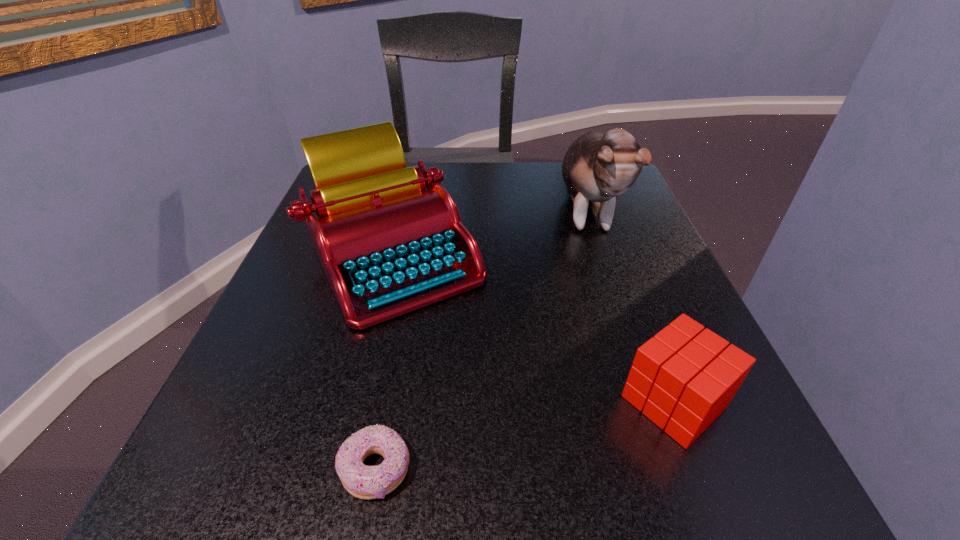
Where is `cube that is at the near edge`? Image resolution: width=960 pixels, height=540 pixels. cube that is at the near edge is located at coordinates (683, 378).

You are a GUI agent. You are given a task and a screenshot of the screen. Output one action in this format:
    pyautogui.click(x=<x>, y=<y>)
    Task: Click on the doughnut present at the near edge
    
    Given the screenshot: What is the action you would take?
    pyautogui.click(x=366, y=482)

You are a GUI agent. You are given a task and a screenshot of the screen. Output one action in this format:
    pyautogui.click(x=<x>, y=<y>)
    Task: Click on the object that is at the left edge
    This screenshot has height=540, width=960.
    Given the screenshot: What is the action you would take?
    pyautogui.click(x=389, y=237)

Where is `cat that is at the right edge`? The height and width of the screenshot is (540, 960). cat that is at the right edge is located at coordinates (597, 167).

Identify the location of cube at the right edge. The width and height of the screenshot is (960, 540). (683, 378).

The height and width of the screenshot is (540, 960). Find the location of `object located in the far left corner section of the desktop`. object located in the far left corner section of the desktop is located at coordinates (389, 237).

I want to click on object present at the far right corner, so click(597, 167).

The height and width of the screenshot is (540, 960). I want to click on object located in the near right corner section of the desktop, so click(683, 378).

In the image, there is a desktop. At what (x,y) coordinates should I click in order to perform the action: click on vacant space at the far edge. Please return your answer as a coordinate pair (x, y). The image size is (960, 540). Looking at the image, I should click on (519, 172).

At what (x,y) coordinates should I click in order to perform the action: click on vacant space at the left edge of the desktop. Please return your answer as a coordinate pair (x, y). The width and height of the screenshot is (960, 540). Looking at the image, I should click on (288, 336).